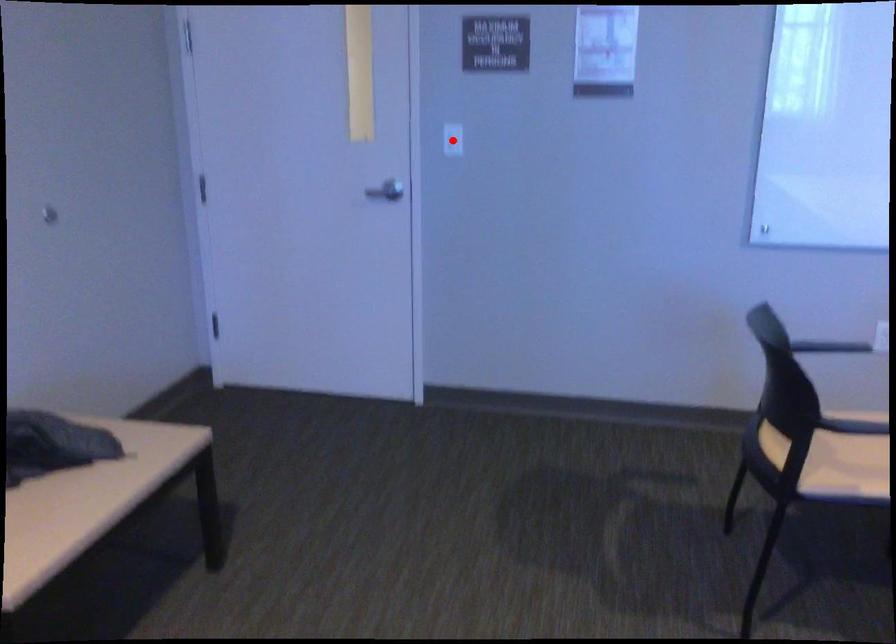
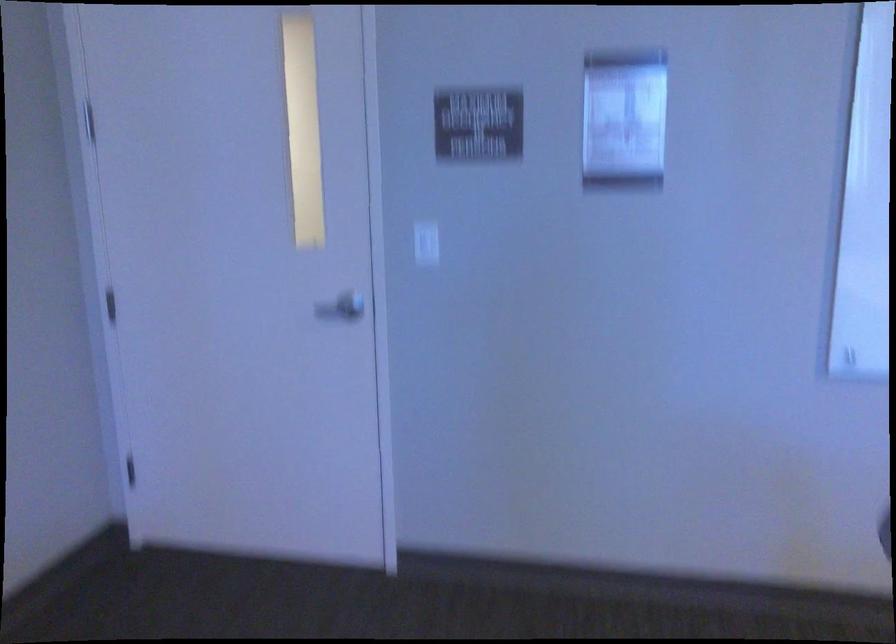
Question: A red point is marked in image1. In image2, is the corresponding 3D point closer to the camera or farther? Reply with the corresponding letter.

Choices:
 (A) The corresponding 3D point is closer.
 (B) The corresponding 3D point is farther.

Answer: (A)